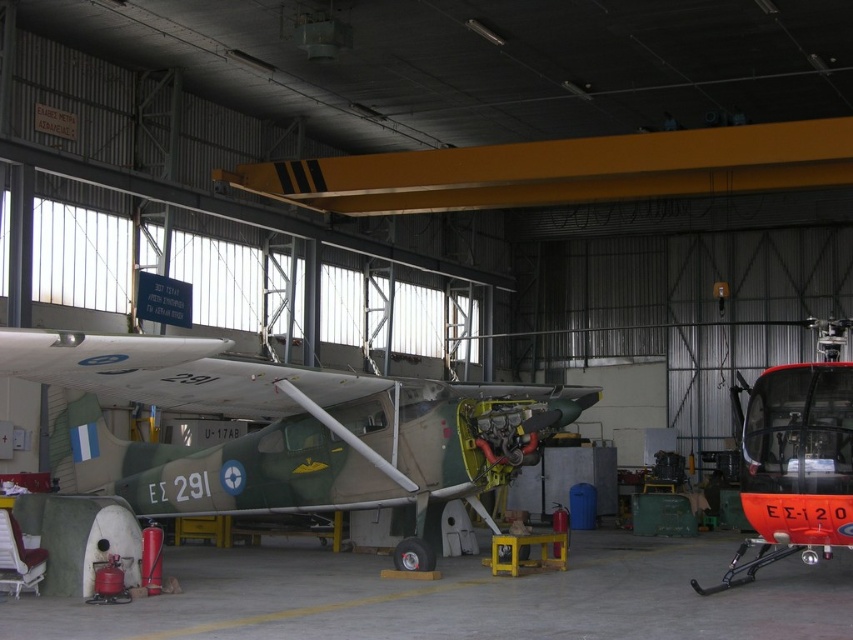
You are a maintenance worker in the hangar. You need to move the orange glossy helicopter at right to the left side of the camouflage paint airplane at center. Is this possible without moving the airplane?

The camouflage paint airplane at center is positioned on the left side of orange glossy helicopter at right, so moving the helicopter to the left of the airplane would require moving the airplane first to create space, making it impossible without moving the airplane.

You are a maintenance worker in the hangar. You need to move a ladder from the orange glossy helicopter at right to the camouflage paint airplane at center. Which object will require a shorter ladder to reach its highest point?

The camouflage paint airplane at center is not as tall as the orange glossy helicopter at right, so a shorter ladder will be needed for the camouflage paint airplane at center.

You are a maintenance technician in the hangar. You need to access the engine of the camouflage paint airplane at center and the orange glossy helicopter at right. Which vehicle will require you to use a ladder to reach its engine?

The camouflage paint airplane at center is above the orange glossy helicopter at right, so you will need a ladder to reach its engine.